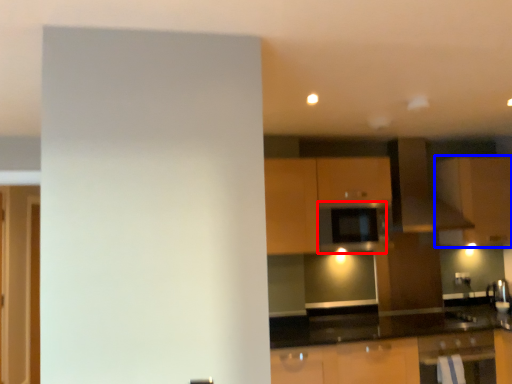
Question: Which object is further to the camera taking this photo, appliance (highlighted by a red box) or cabinetry (highlighted by a blue box)?

Choices:
 (A) appliance
 (B) cabinetry

Answer: (B)